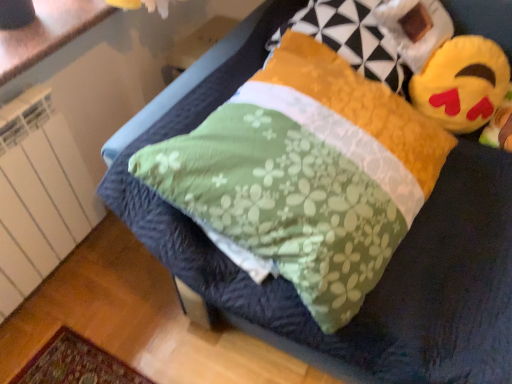
Find the location of a particular element. Image resolution: width=512 pixels, height=384 pixels. white glossy countertop at upper left is located at coordinates (47, 33).

This screenshot has width=512, height=384. In order to click on yellow plush toy at upper right in this screenshot , I will do `click(462, 83)`.

You are a GUI agent. You are given a task and a screenshot of the screen. Output one action in this format:
    pyautogui.click(x=<x>, y=<y>)
    Task: Click on the fluffy yellow pillow at upper right
    This screenshot has height=384, width=512.
    Given the screenshot: What is the action you would take?
    pyautogui.click(x=350, y=38)

Locate an element on the screen. Image resolution: width=512 pixels, height=384 pixels. pillow located underneath the white glossy countertop at upper left (from a real-world perspective) is located at coordinates (350, 38).

From a real-world perspective, which is physically below, fluffy yellow pillow at upper right or white glossy countertop at upper left?

fluffy yellow pillow at upper right, from a real-world perspective.

Does point (399, 59) appear closer or farther from the camera than point (87, 27)?

Point (399, 59) is closer to the camera than point (87, 27).

Does yellow plush toy at upper right have a greater height compared to white glossy countertop at upper left?

Indeed, yellow plush toy at upper right has a greater height compared to white glossy countertop at upper left.

Which is behind, yellow plush toy at upper right or white glossy countertop at upper left?

Positioned behind is yellow plush toy at upper right.

From a real-world perspective, is yellow plush toy at upper right on white glossy countertop at upper left?

Incorrect, from a real-world perspective, yellow plush toy at upper right is lower than white glossy countertop at upper left.

Consider the image. How different are the orientations of yellow plush toy at upper right and white glossy countertop at upper left in degrees?

80.2 degrees separate the facing orientations of yellow plush toy at upper right and white glossy countertop at upper left.

Consider the image. Which object is closer to the camera, white glossy countertop at upper left or yellow plush toy at upper right?

white glossy countertop at upper left is closer to the camera.

Between white glossy countertop at upper left and yellow plush toy at upper right, which one has smaller width?

yellow plush toy at upper right is thinner.

Which is farther from the camera, (9,52) or (496,68)?

Positioned behind is point (496,68).

From a real-world perspective, does white glossy countertop at upper left sit lower than yellow plush toy at upper right?

No, from a real-world perspective, white glossy countertop at upper left is not under yellow plush toy at upper right.

Where is `pillow in front of the yellow plush toy at upper right`? This screenshot has width=512, height=384. pillow in front of the yellow plush toy at upper right is located at coordinates (350, 38).

Are fluffy yellow pillow at upper right and yellow plush toy at upper right beside each other?

No.

How many degrees apart are the facing directions of fluffy yellow pillow at upper right and yellow plush toy at upper right?

The angular difference between fluffy yellow pillow at upper right and yellow plush toy at upper right is 75.6 degrees.

From a real-world perspective, is fluffy yellow pillow at upper right physically above yellow plush toy at upper right?

Yes, from a real-world perspective, fluffy yellow pillow at upper right is on top of yellow plush toy at upper right.

In terms of height, does yellow plush toy at upper right look taller or shorter compared to fluffy yellow pillow at upper right?

yellow plush toy at upper right is shorter than fluffy yellow pillow at upper right.

How far apart are yellow plush toy at upper right and fluffy yellow pillow at upper right?

yellow plush toy at upper right and fluffy yellow pillow at upper right are 7.73 inches apart.

From the image's perspective, is yellow plush toy at upper right beneath fluffy yellow pillow at upper right?

Correct, yellow plush toy at upper right appears lower than fluffy yellow pillow at upper right in the image.

Can you confirm if yellow plush toy at upper right is thinner than fluffy yellow pillow at upper right?

Yes, yellow plush toy at upper right is thinner than fluffy yellow pillow at upper right.

From a real-world perspective, is white glossy countertop at upper left positioned under fluffy yellow pillow at upper right based on gravity?

No, from a real-world perspective, white glossy countertop at upper left is not under fluffy yellow pillow at upper right.

Does white glossy countertop at upper left come in front of fluffy yellow pillow at upper right?

No, white glossy countertop at upper left is further to the viewer.

Locate an element on the screen. counter top lying on the left of fluffy yellow pillow at upper right is located at coordinates (47, 33).

At what (x,y) coordinates should I click in order to perform the action: click on counter top that is above the fluffy yellow pillow at upper right (from the image's perspective). Please return your answer as a coordinate pair (x, y). Looking at the image, I should click on (47, 33).

Locate an element on the screen. toy beneath the white glossy countertop at upper left (from a real-world perspective) is located at coordinates (462, 83).

Which object lies further to the anchor point fluffy yellow pillow at upper right, white glossy countertop at upper left or yellow plush toy at upper right?

white glossy countertop at upper left is positioned further to the anchor fluffy yellow pillow at upper right.

Considering their positions, is white glossy countertop at upper left positioned closer to yellow plush toy at upper right than fluffy yellow pillow at upper right?

The object closer to yellow plush toy at upper right is fluffy yellow pillow at upper right.

Considering their positions, is fluffy yellow pillow at upper right positioned further to yellow plush toy at upper right than white glossy countertop at upper left?

white glossy countertop at upper left.

Which object lies nearer to the anchor point white glossy countertop at upper left, fluffy yellow pillow at upper right or yellow plush toy at upper right?

fluffy yellow pillow at upper right is positioned closer to the anchor white glossy countertop at upper left.

Based on their spatial positions, is yellow plush toy at upper right or white glossy countertop at upper left closer to fluffy yellow pillow at upper right?

Among the two, yellow plush toy at upper right is located nearer to fluffy yellow pillow at upper right.

Estimate the real-world distances between objects in this image. Which object is closer to white glossy countertop at upper left, yellow plush toy at upper right or fluffy yellow pillow at upper right?

Among the two, fluffy yellow pillow at upper right is located nearer to white glossy countertop at upper left.

Where is `pillow located between white glossy countertop at upper left and yellow plush toy at upper right in the left-right direction`? Image resolution: width=512 pixels, height=384 pixels. pillow located between white glossy countertop at upper left and yellow plush toy at upper right in the left-right direction is located at coordinates (350, 38).